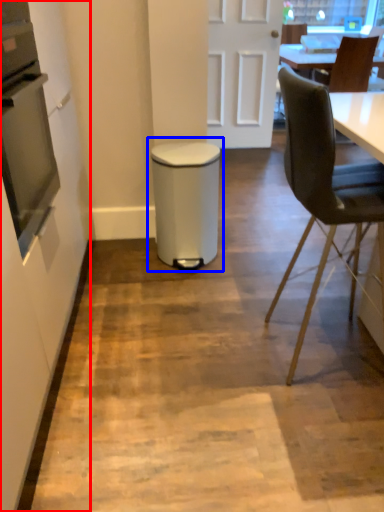
Question: Which of the following is the farthest to the observer, side (highlighted by a red box) or waste container (highlighted by a blue box)?

Choices:
 (A) side
 (B) waste container

Answer: (B)